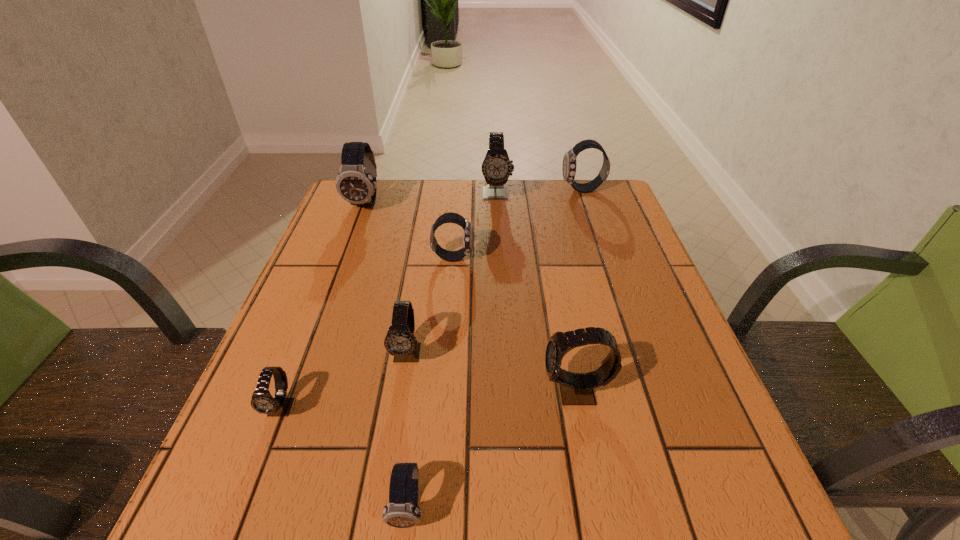
Find the location of a particular element. free spot between the second nearest dark watch and the biggest dark watch is located at coordinates (410, 230).

Identify the location of free spot between the nearest watch and the third smallest gray watch. The width and height of the screenshot is (960, 540). (492, 449).

Where is `empty location between the second object from right to left and the second smallest dark watch`? empty location between the second object from right to left and the second smallest dark watch is located at coordinates (515, 325).

Find the location of `vacant area that lies between the leftmost gray watch and the rightmost object`. vacant area that lies between the leftmost gray watch and the rightmost object is located at coordinates (432, 299).

At what (x,y) coordinates should I click in order to perform the action: click on free space between the third watch from right to left and the nearest dark watch. Please return your answer as a coordinate pair (x, y). Looking at the image, I should click on (452, 350).

Identify the location of the fifth closest object to the third smallest gray watch. (496, 168).

Where is `the seventh closest object to the farthest gray watch`? Image resolution: width=960 pixels, height=540 pixels. the seventh closest object to the farthest gray watch is located at coordinates (402, 511).

Select which watch appears as the second closest to the rightmost dark watch. Please provide its 2D coordinates. Your answer should be formatted as a tuple, i.e. [(x, y)], where the tuple contains the x and y coordinates of a point satisfying the conditions above.

[(451, 256)]

The height and width of the screenshot is (540, 960). Identify the location of watch that is the closest one to the rightmost object. (496, 168).

What are the coordinates of `the fourth closest gray watch to the third smallest dark watch` in the screenshot? It's located at (262, 401).